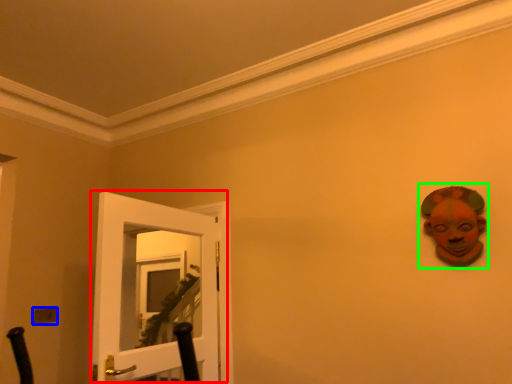
Question: Based on their relative distances, which object is nearer to door (highlighted by a red box)? Choose from light switch (highlighted by a blue box) and person (highlighted by a green box).

Choices:
 (A) light switch
 (B) person

Answer: (A)